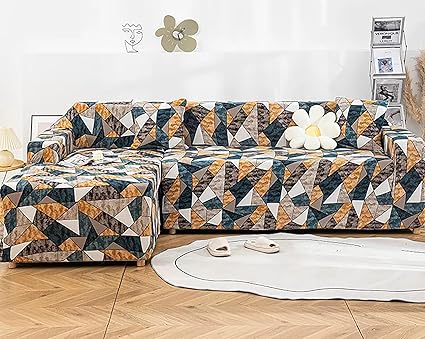
This screenshot has width=425, height=339. In order to click on end table in this screenshot , I will do `click(13, 162)`.